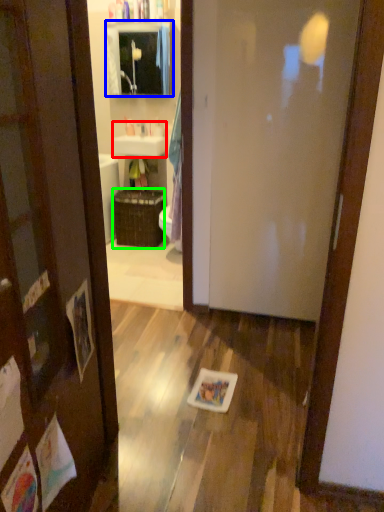
Question: Estimate the real-world distances between objects in this image. Which object is farther from sink (highlighted by a red box), cabinetry (highlighted by a blue box) or basket (highlighted by a green box)?

Choices:
 (A) cabinetry
 (B) basket

Answer: (A)